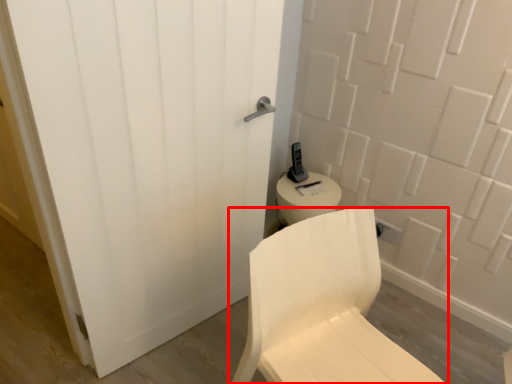
Question: From the image's perspective, considering the relative positions of chair (annotated by the red box) and door in the image provided, where is chair (annotated by the red box) located with respect to the staircase?

Choices:
 (A) above
 (B) below

Answer: (B)